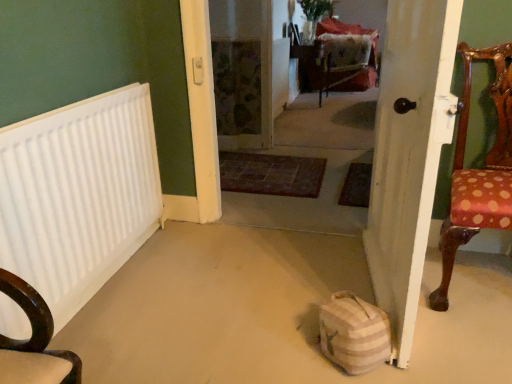
Where is `free space between white matte radiator at left and polka dot fabric chair at right`? This screenshot has height=384, width=512. free space between white matte radiator at left and polka dot fabric chair at right is located at coordinates pyautogui.click(x=233, y=296).